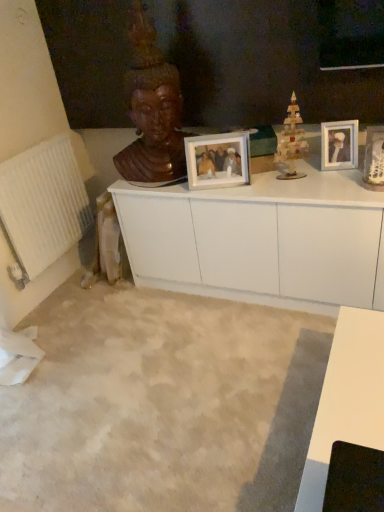
Question: From the image's perspective, is wooden toy at center on top of wooden statue at upper center?

Choices:
 (A) no
 (B) yes

Answer: (A)

Question: Can you confirm if wooden toy at center is bigger than wooden statue at upper center?

Choices:
 (A) yes
 (B) no

Answer: (B)

Question: Is wooden toy at center smaller than wooden statue at upper center?

Choices:
 (A) yes
 (B) no

Answer: (A)

Question: Considering the relative positions of wooden toy at center and wooden statue at upper center in the image provided, is wooden toy at center behind wooden statue at upper center?

Choices:
 (A) no
 (B) yes

Answer: (B)

Question: Is wooden statue at upper center at the back of wooden toy at center?

Choices:
 (A) no
 (B) yes

Answer: (A)

Question: From a real-world perspective, is white glossy picture frame at upper right, the 2th picture frame from the left, above or below white textured radiator at left?

Choices:
 (A) above
 (B) below

Answer: (A)

Question: Is point (327, 133) positioned closer to the camera than point (52, 251)?

Choices:
 (A) farther
 (B) closer

Answer: (B)

Question: From the image's perspective, is white glossy picture frame at upper right, the 1th picture frame from the right, located above or below white textured radiator at left?

Choices:
 (A) above
 (B) below

Answer: (A)

Question: Would you say white glossy picture frame at upper right, the 1th picture frame from the right, is inside or outside white textured radiator at left?

Choices:
 (A) inside
 (B) outside

Answer: (B)

Question: In terms of height, does matte white picture frame at center, the 2th picture frame in the right-to-left sequence, look taller or shorter compared to white glossy picture frame at upper right, the 1th picture frame from the right?

Choices:
 (A) short
 (B) tall

Answer: (B)

Question: Would you say matte white picture frame at center, which is the 1th picture frame from left to right, is to the left or to the right of white glossy picture frame at upper right, the 1th picture frame from the right, in the picture?

Choices:
 (A) right
 (B) left

Answer: (B)

Question: Considering the positions of point (238, 174) and point (339, 146), is point (238, 174) closer or farther from the camera than point (339, 146)?

Choices:
 (A) farther
 (B) closer

Answer: (A)

Question: Looking at the image, does matte white picture frame at center, which is the 1th picture frame from left to right, seem bigger or smaller compared to white glossy picture frame at upper right, the 1th picture frame from the right?

Choices:
 (A) small
 (B) big

Answer: (B)

Question: Is white glossy cabinet at center in front of or behind white glossy picture frame at upper right, the 2th picture frame from the left, in the image?

Choices:
 (A) front
 (B) behind

Answer: (A)

Question: From the image's perspective, is white glossy cabinet at center above or below white glossy picture frame at upper right, the 2th picture frame from the left?

Choices:
 (A) below
 (B) above

Answer: (A)